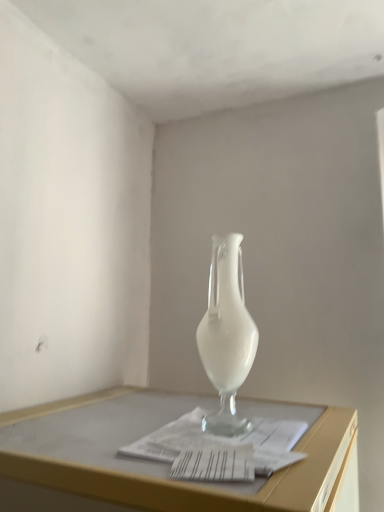
Looking at this image, in order to face white glass vase at center, should I rotate leftwards or rightwards?

It's best to rotate right around 4.384 degrees.

This screenshot has width=384, height=512. What do you see at coordinates (227, 335) in the screenshot?
I see `white glass vase at center` at bounding box center [227, 335].

This screenshot has width=384, height=512. What are the coordinates of `white glass vase at center` in the screenshot? It's located at (227, 335).

Where is `white paper at center`? white paper at center is located at coordinates [x=223, y=441].

The height and width of the screenshot is (512, 384). What do you see at coordinates (223, 441) in the screenshot? I see `white paper at center` at bounding box center [223, 441].

Where is `white glass vase at center`? This screenshot has width=384, height=512. white glass vase at center is located at coordinates (227, 335).

Considering the relative positions of white glass vase at center and white paper at center in the image provided, is white glass vase at center to the left or to the right of white paper at center?

Based on their positions, white glass vase at center is located to the right of white paper at center.

Which is in front, white glass vase at center or white paper at center?

Positioned in front is white paper at center.

Is point (232, 250) closer or farther from the camera than point (131, 447)?

Point (232, 250) is positioned farther from the camera compared to point (131, 447).

From the image's perspective, is white glass vase at center under white paper at center?

No.

From a real-world perspective, is white glass vase at center located beneath white paper at center?

Actually, white glass vase at center is physically above white paper at center in the real world.

Considering the relative sizes of white glass vase at center and white paper at center in the image provided, is white glass vase at center thinner than white paper at center?

Yes.

In terms of height, does white glass vase at center look taller or shorter compared to white paper at center?

Clearly, white glass vase at center is taller compared to white paper at center.

In the scene shown: Considering the relative sizes of white glass vase at center and white paper at center in the image provided, is white glass vase at center smaller than white paper at center?

Actually, white glass vase at center might be larger than white paper at center.

Is white glass vase at center inside or outside of white paper at center?

white glass vase at center is not enclosed by white paper at center.

Can you see white glass vase at center touching white paper at center?

white glass vase at center and white paper at center are clearly separated.

Consider the image. Could you tell me if white glass vase at center is turned towards white paper at center?

No, white glass vase at center does not turn towards white paper at center.

What's the angular difference between white glass vase at center and white paper at center's facing directions?

They differ by 0.000763 degrees in their facing directions.

This screenshot has height=512, width=384. Identify the location of magazine on the left of the white glass vase at center. (223, 441).

Between white paper at center and white glass vase at center, which one appears on the right side from the viewer's perspective?

white glass vase at center.

Which is behind, white paper at center or white glass vase at center?

Positioned behind is white glass vase at center.

Does point (281, 421) appear closer or farther from the camera than point (196, 334)?

Point (281, 421) is positioned closer to the camera compared to point (196, 334).

From the image's perspective, between white paper at center and white glass vase at center, which one is located above?

white glass vase at center.

From a real-world perspective, between white paper at center and white glass vase at center, who is vertically higher?

white glass vase at center, from a real-world perspective.

Is white paper at center thinner than white glass vase at center?

No.

Who is taller, white paper at center or white glass vase at center?

white glass vase at center is taller.

Considering the relative sizes of white paper at center and white glass vase at center in the image provided, is white paper at center bigger than white glass vase at center?

Incorrect, white paper at center is not larger than white glass vase at center.

Consider the image. Can we say white paper at center lies outside white glass vase at center?

Yes, white paper at center is not within white glass vase at center.

Is the surface of white paper at center in direct contact with white glass vase at center?

white paper at center and white glass vase at center are clearly separated.

Is white paper at center facing away from white glass vase at center?

No.

How many degrees apart are the facing directions of white paper at center and white glass vase at center?

white paper at center and white glass vase at center are facing 0.000763 degrees away from each other.

The image size is (384, 512). I want to click on magazine located in front of the white glass vase at center, so (223, 441).

Image resolution: width=384 pixels, height=512 pixels. I want to click on magazine that is on the left side of white glass vase at center, so click(223, 441).

Where is `magazine located below the white glass vase at center (from the image's perspective)`? This screenshot has height=512, width=384. magazine located below the white glass vase at center (from the image's perspective) is located at coordinates (223, 441).